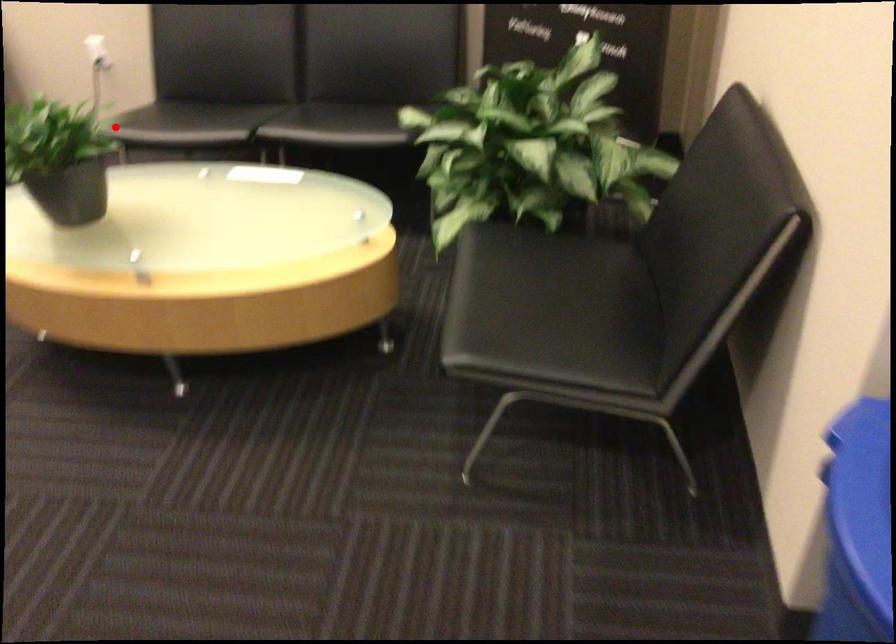
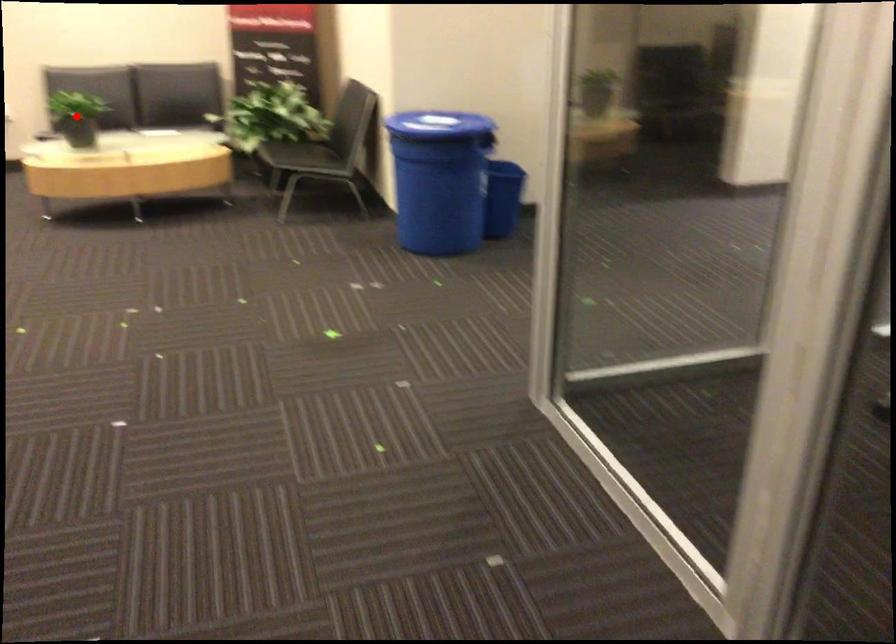
I am providing you with two images of the same scene from different viewpoints. A red point is marked on the first image and another point is marked on the second image. Are the points marked in image1 and image2 representing the same 3D position?

Yes